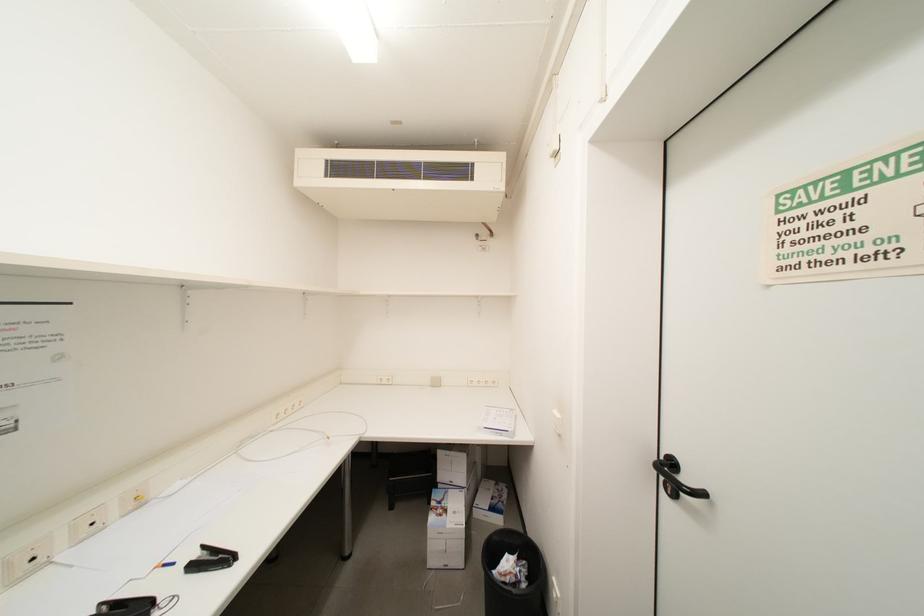
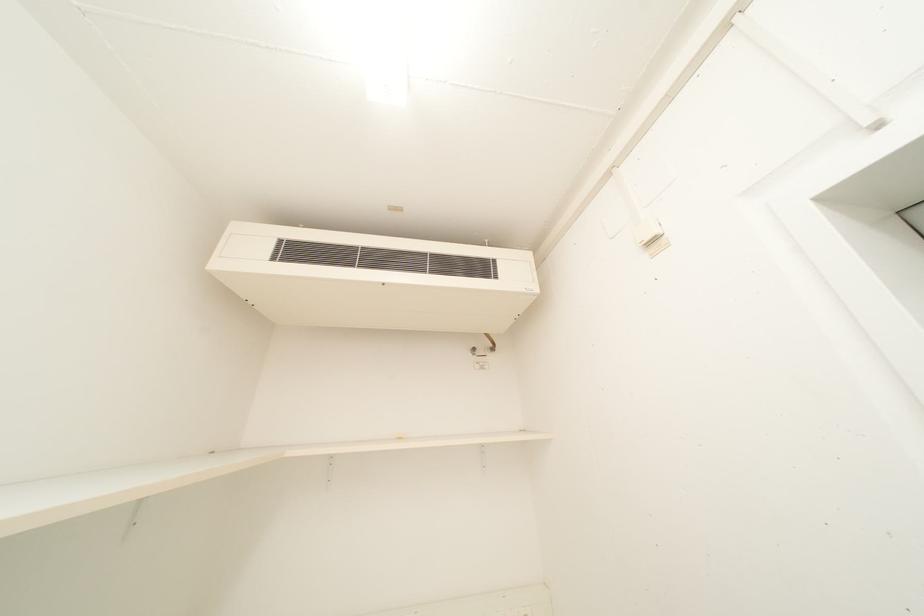
What movement of the cameraman would produce the second image?

The cameraman moved toward left, forward.